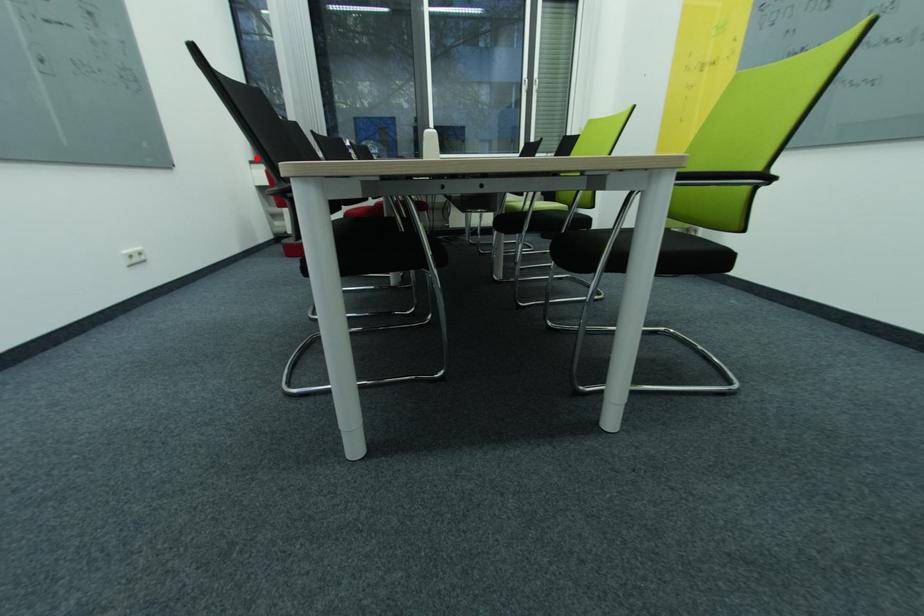
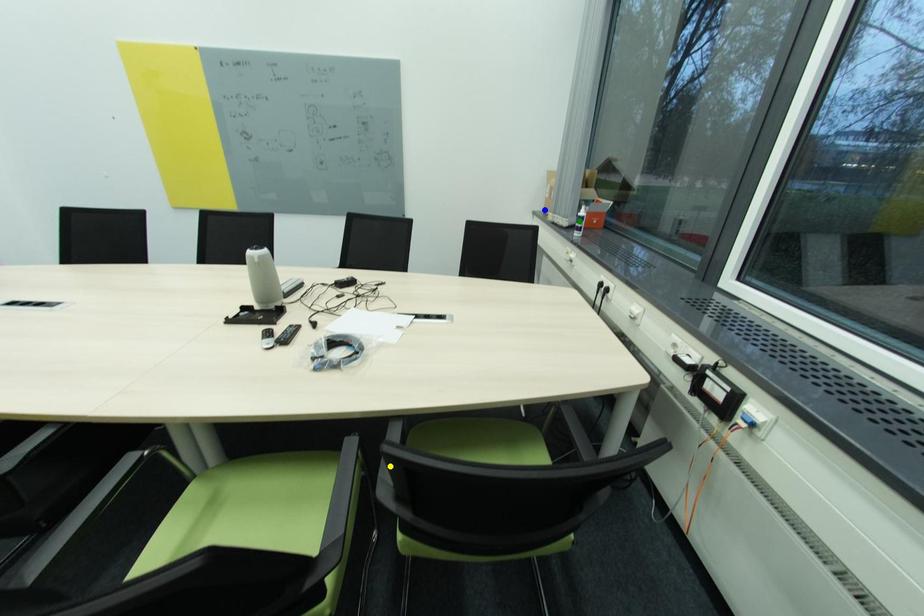
Question: I am providing you with two images of the same scene from different viewpoints. A red point is marked on the first image. You are given multiple points on the second image. Which point in image 2 is actually the same real-world point as the red point in image 1?

Choices:
 (A) yellow point
 (B) green point
 (C) blue point

Answer: (C)